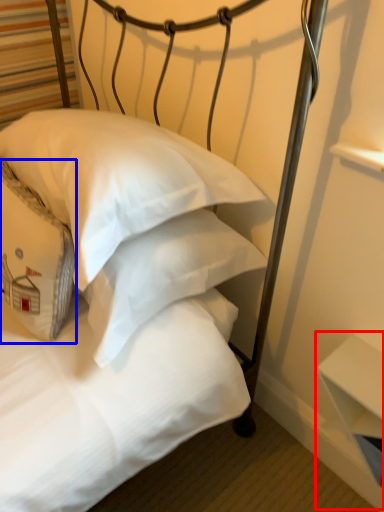
Question: Which of the following is the farthest to the observer, table (highlighted by a red box) or pillow (highlighted by a blue box)?

Choices:
 (A) table
 (B) pillow

Answer: (A)